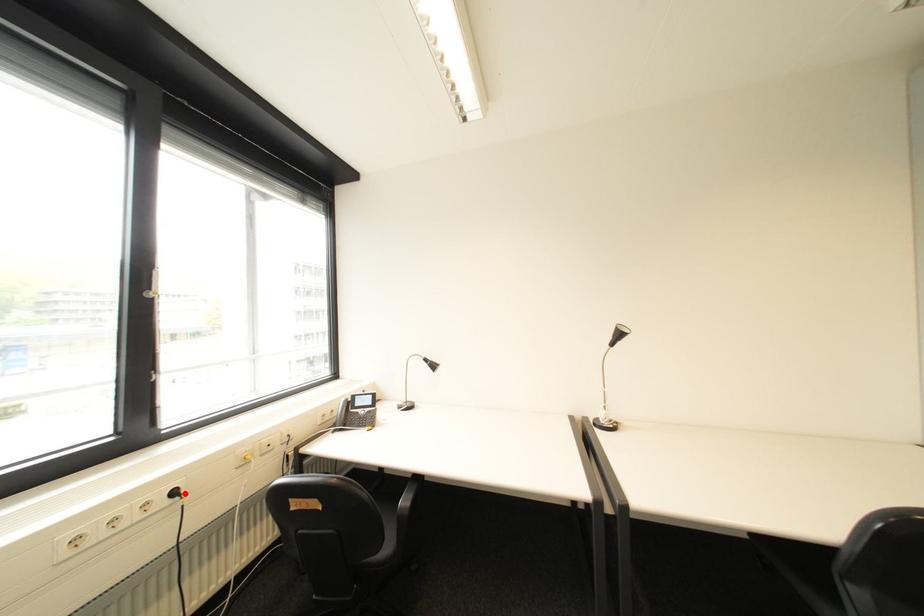
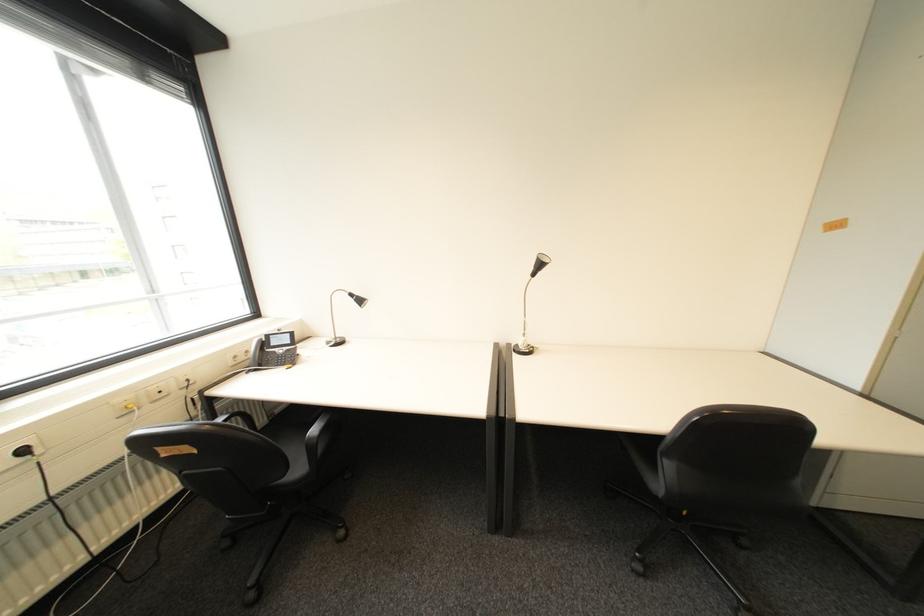
In the second image, find the point that corresponds to the highlighted location in the first image.

(34, 452)